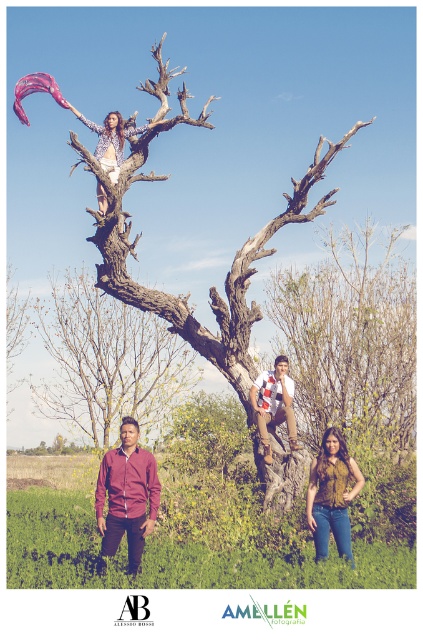
You are a photographer trying to capture a clear shot of the maroon shirt at center and the brown textured tree trunk at upper center. Which object is closer to the camera?

The brown textured tree trunk at upper center is closer to the camera since the maroon shirt at center is behind it.

You are standing 5 meters away from the smooth bark tree at center. If you want to take a photo of the tree using a camera that requires a minimum distance of 25 meters for clear focus, can you do it from your current position?

The smooth bark tree at center and camera are 30.42 meters apart from each other. Since you are currently 5 meters away from the tree, the total distance between you and the camera would be 30.42 meters minus your 5 meters, which is 25.42 meters. This meets the minimum required distance of 25 meters, so yes, you can take a clear photo from your current position.

You are a photographer trying to capture a photo of both the bare wood tree at center and the smooth bark tree at center. Since you want to highlight the height difference between them, which tree should you position closer to the camera to emphasize its height?

To emphasize the height difference, position the bare wood tree at center closer to the camera since it is taller than the smooth bark tree at center.